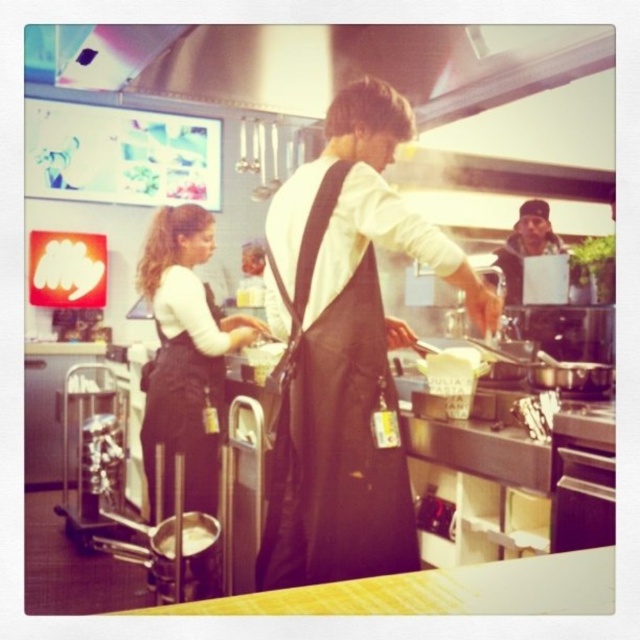
Question: Is dark gray apron at center-left closer to camera compared to yellow matte bowl at center?

Choices:
 (A) no
 (B) yes

Answer: (A)

Question: Which object appears closest to the camera in this image?

Choices:
 (A) dark gray knit cap at upper right
 (B) yellow matte bowl at center
 (C) black fabric apron at center

Answer: (C)

Question: Considering the real-world distances, which object is closest to the black fabric apron at center?

Choices:
 (A) yellow matte bowl at center
 (B) dark gray knit cap at upper right
 (C) dark gray apron at center-left

Answer: (A)

Question: Does dark gray apron at center-left have a larger size compared to dark gray knit cap at upper right?

Choices:
 (A) yes
 (B) no

Answer: (A)

Question: Is black fabric apron at center below yellow matte bowl at center?

Choices:
 (A) yes
 (B) no

Answer: (B)

Question: Which point is farther from the camera taking this photo?

Choices:
 (A) (172, 538)
 (B) (524, 243)
 (C) (400, 486)
 (D) (154, 234)

Answer: (B)